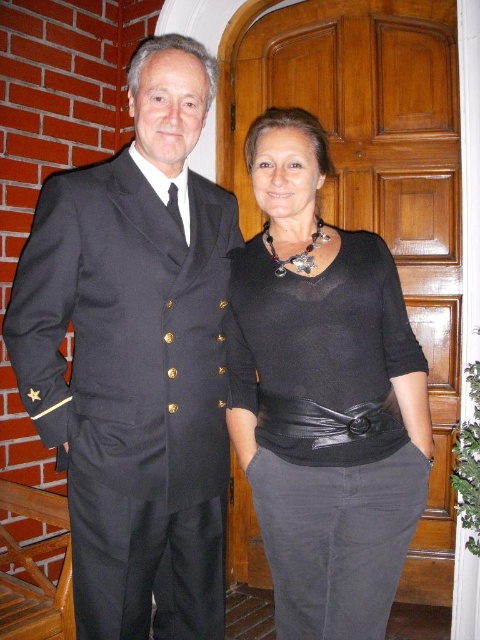
Describe the element at coordinates (135, 358) in the screenshot. I see `black wool suit at left` at that location.

How distant is black wool suit at left from black matte sweater at center?

9.73 inches

I want to click on black wool suit at left, so click(135, 358).